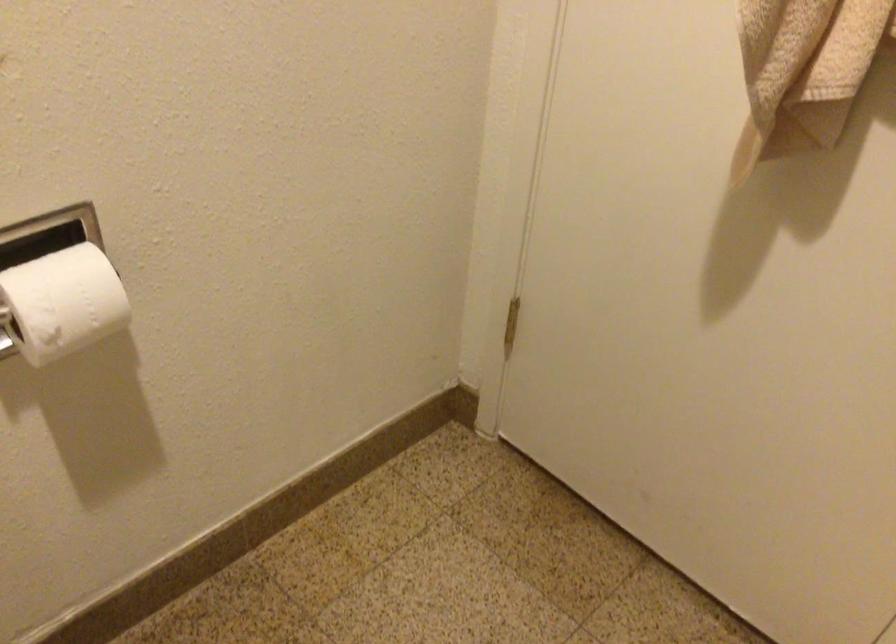
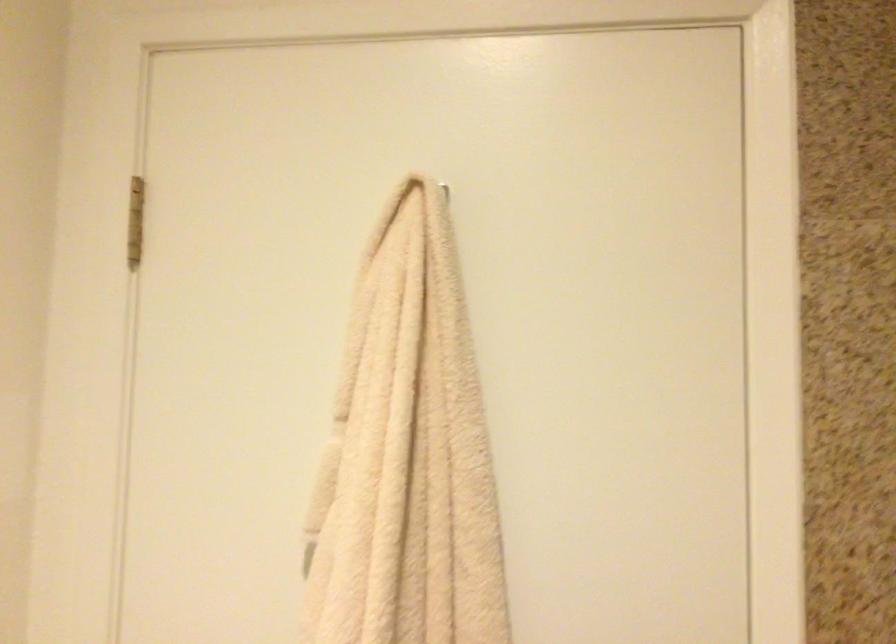
First-person continuous shooting, in which direction is the camera rotating?

The camera rotated toward right-up.